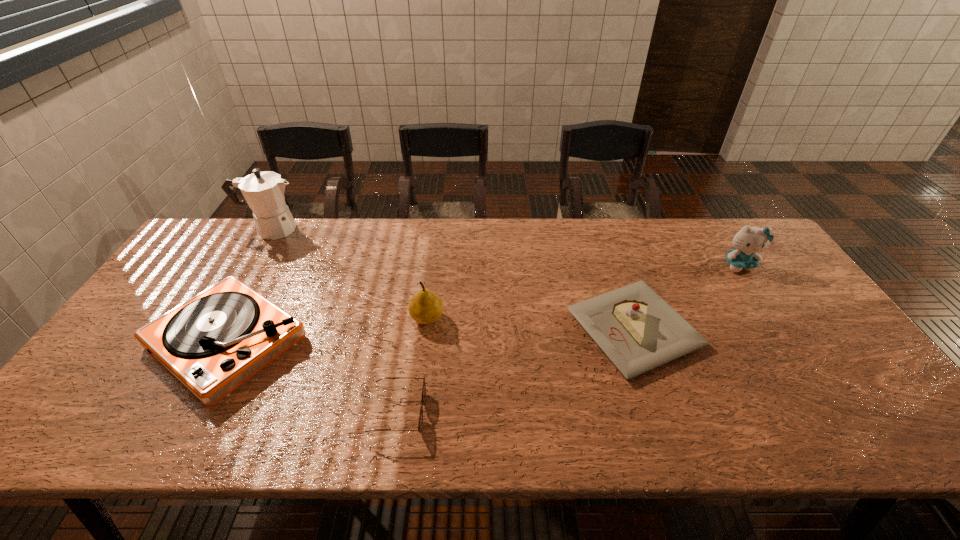
Image resolution: width=960 pixels, height=540 pixels. Identify the location of the tallest object. (263, 191).

You are a GUI agent. You are given a task and a screenshot of the screen. Output one action in this format:
    pyautogui.click(x=<x>, y=<y>)
    Task: Click on the coffeepot
    This screenshot has width=960, height=540.
    Given the screenshot: What is the action you would take?
    pyautogui.click(x=263, y=191)

Image resolution: width=960 pixels, height=540 pixels. I want to click on the rightmost object, so click(748, 241).

Find the location of a particular element. The image size is (960, 540). the fifth nearest object is located at coordinates (748, 241).

At what (x,y) coordinates should I click in order to perform the action: click on pear. Please return your answer as a coordinate pair (x, y). This screenshot has width=960, height=540. Looking at the image, I should click on (425, 307).

Where is `record player`? record player is located at coordinates (212, 343).

Locate an element on the screen. The width and height of the screenshot is (960, 540). the fifth object from left to right is located at coordinates (638, 331).

You are a GUI agent. You are given a task and a screenshot of the screen. Output one action in this format:
    pyautogui.click(x=<x>, y=<y>)
    Task: Click on the spectacles
    
    Given the screenshot: What is the action you would take?
    pyautogui.click(x=420, y=424)

The image size is (960, 540). In order to click on vacant space located 0.180m at the spout of the farthest object in this screenshot , I will do `click(355, 230)`.

Where is `vacant point located 0.200m on the face of the second farthest object`? The height and width of the screenshot is (540, 960). vacant point located 0.200m on the face of the second farthest object is located at coordinates (779, 324).